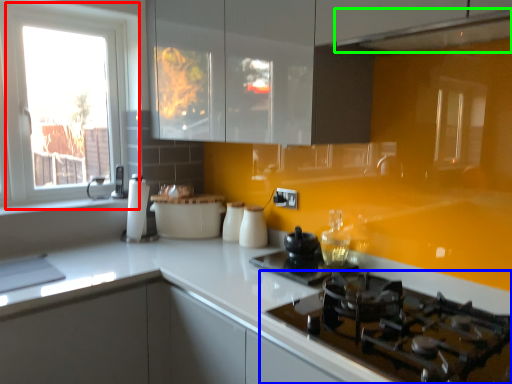
Question: Which object is the farthest from window (highlighted by a red box)? Choose among these: gas stove (highlighted by a blue box) or exhaust hood (highlighted by a green box).

Choices:
 (A) gas stove
 (B) exhaust hood

Answer: (A)